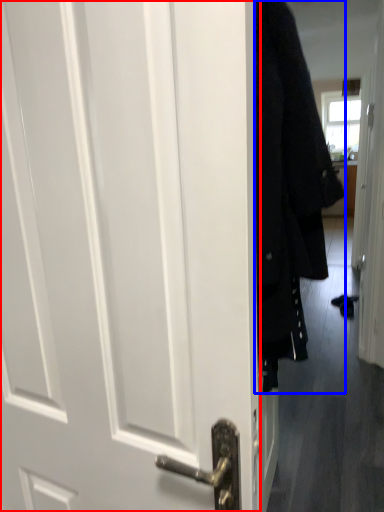
Question: Which object appears farthest to the camera in this image, door (highlighted by a red box) or coat (highlighted by a blue box)?

Choices:
 (A) door
 (B) coat

Answer: (B)